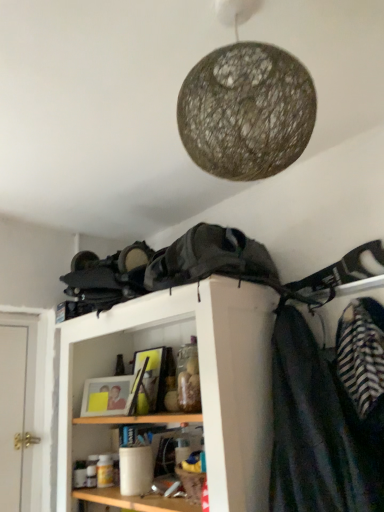
Question: Can you confirm if wooden shelf at center is thinner than woven natural fiber lampshade at upper center?

Choices:
 (A) no
 (B) yes

Answer: (A)

Question: Considering the relative positions of wooden shelf at center and woven natural fiber lampshade at upper center in the image provided, is wooden shelf at center to the right of woven natural fiber lampshade at upper center from the viewer's perspective?

Choices:
 (A) yes
 (B) no

Answer: (B)

Question: Is wooden shelf at center outside woven natural fiber lampshade at upper center?

Choices:
 (A) no
 (B) yes

Answer: (B)

Question: Does wooden shelf at center have a larger size compared to woven natural fiber lampshade at upper center?

Choices:
 (A) no
 (B) yes

Answer: (B)

Question: From the image's perspective, would you say wooden shelf at center is positioned over woven natural fiber lampshade at upper center?

Choices:
 (A) yes
 (B) no

Answer: (B)

Question: Is striped fabric at right inside or outside of woven natural fiber lampshade at upper center?

Choices:
 (A) outside
 (B) inside

Answer: (A)

Question: From a real-world perspective, relative to woven natural fiber lampshade at upper center, is striped fabric at right vertically above or below?

Choices:
 (A) below
 (B) above

Answer: (A)

Question: Is striped fabric at right taller or shorter than woven natural fiber lampshade at upper center?

Choices:
 (A) short
 (B) tall

Answer: (B)

Question: In the image, is striped fabric at right positioned in front of or behind woven natural fiber lampshade at upper center?

Choices:
 (A) front
 (B) behind

Answer: (B)

Question: Considering the positions of point (213, 313) and point (342, 459), is point (213, 313) closer or farther from the camera than point (342, 459)?

Choices:
 (A) farther
 (B) closer

Answer: (A)

Question: Is wooden shelf at center inside the boundaries of striped fabric at right, or outside?

Choices:
 (A) outside
 (B) inside

Answer: (A)

Question: In terms of width, does wooden shelf at center look wider or thinner when compared to striped fabric at right?

Choices:
 (A) wide
 (B) thin

Answer: (A)

Question: From the image's perspective, is wooden shelf at center positioned above or below striped fabric at right?

Choices:
 (A) below
 (B) above

Answer: (A)

Question: Based on their positions, is striped fabric at right located to the left or right of wooden shelf at center?

Choices:
 (A) left
 (B) right

Answer: (B)

Question: Would you say striped fabric at right is inside or outside wooden shelf at center?

Choices:
 (A) inside
 (B) outside

Answer: (B)